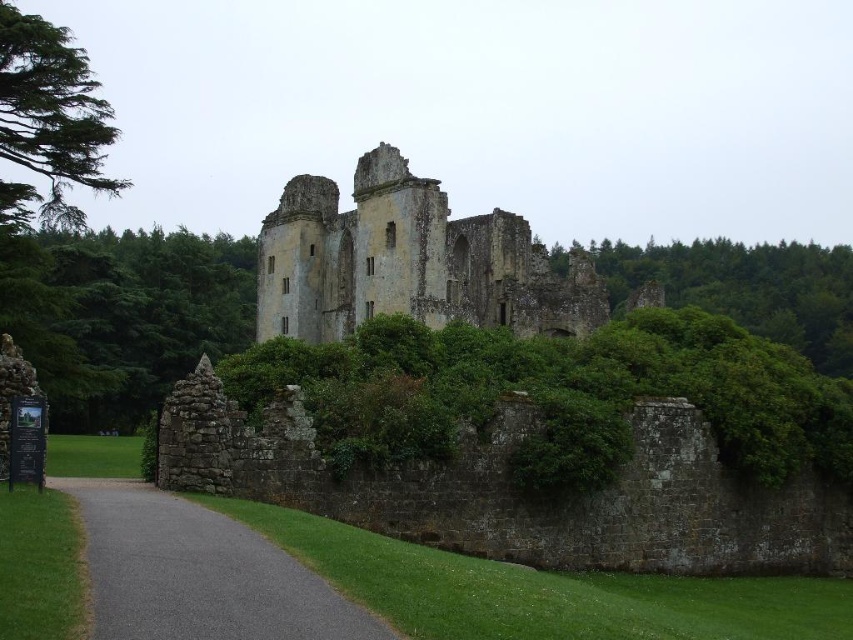
What do you see at coordinates (409, 260) in the screenshot? I see `weathered stone castle at center` at bounding box center [409, 260].

Identify the location of weathered stone castle at center. This screenshot has height=640, width=853. (409, 260).

Who is more distant from viewer, (531, 262) or (312, 624)?

The point (531, 262) is more distant.

Find the location of a particular element. weathered stone castle at center is located at coordinates (409, 260).